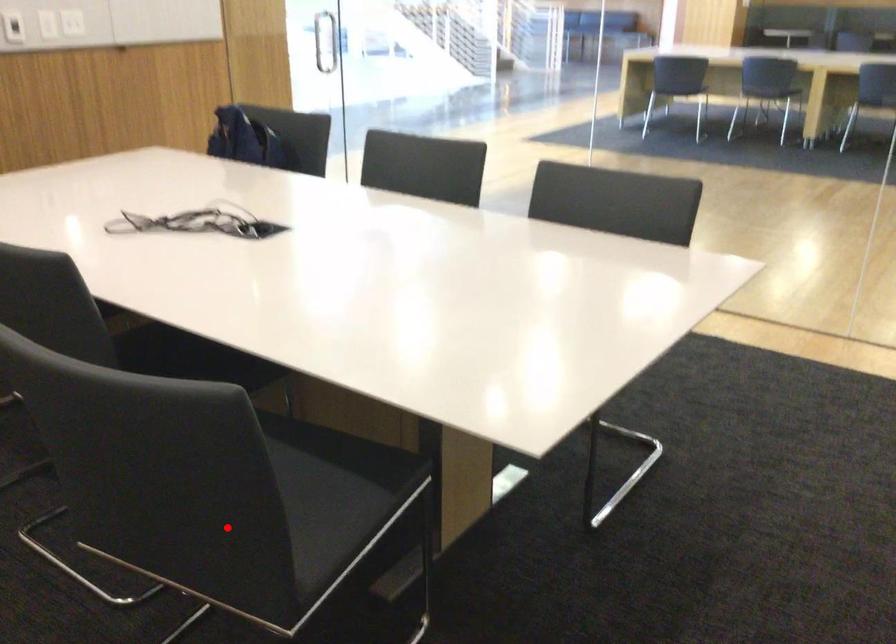
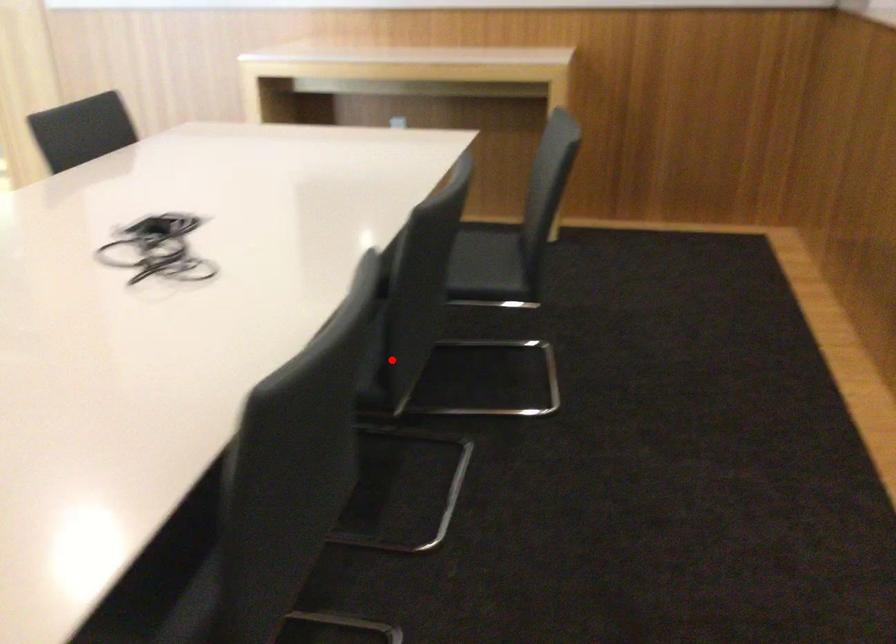
I am providing you with two images of the same scene from different viewpoints. A red point is marked on the first image and another point is marked on the second image. Are the points marked in image1 and image2 representing the same 3D position?

No